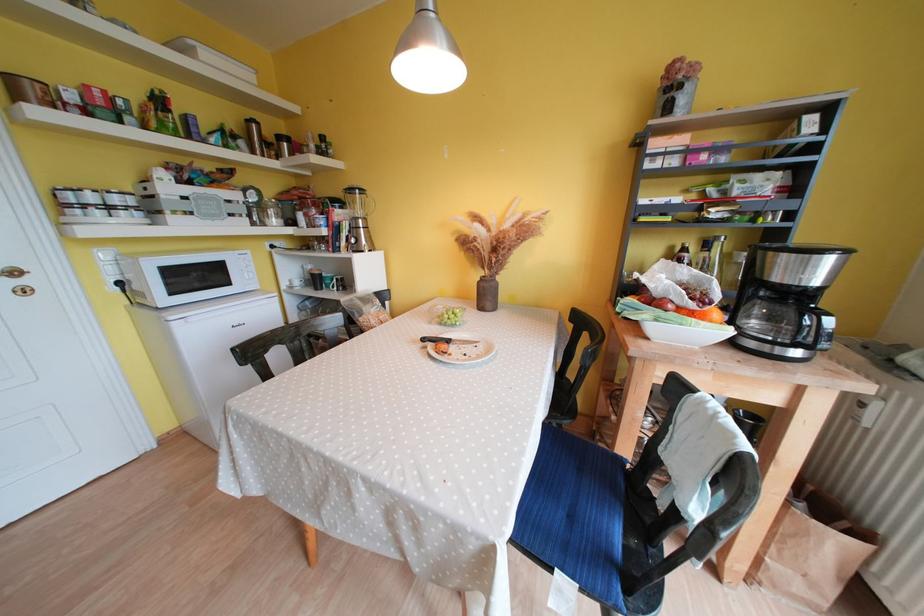
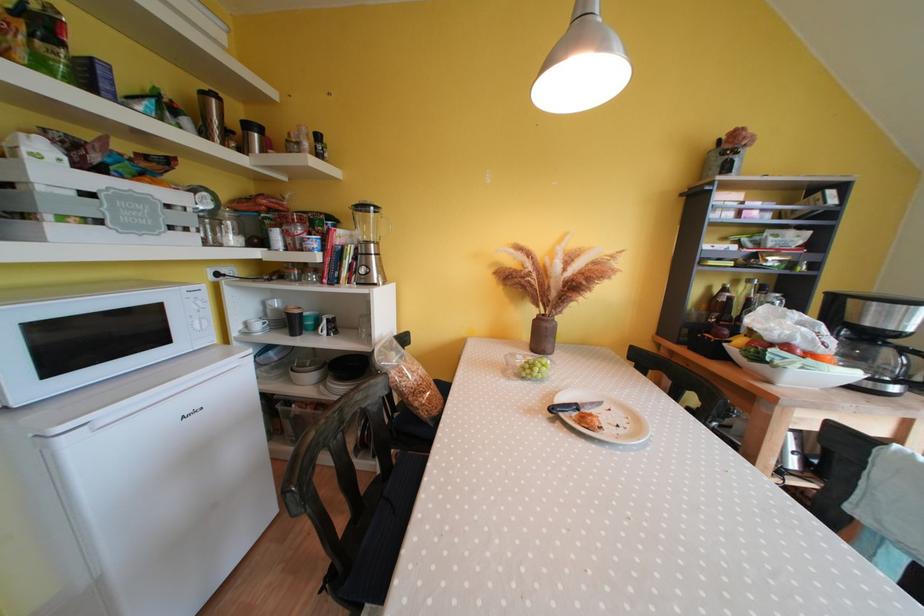
In the second image, find the point that corresponds to (286,140) in the first image.

(252, 130)